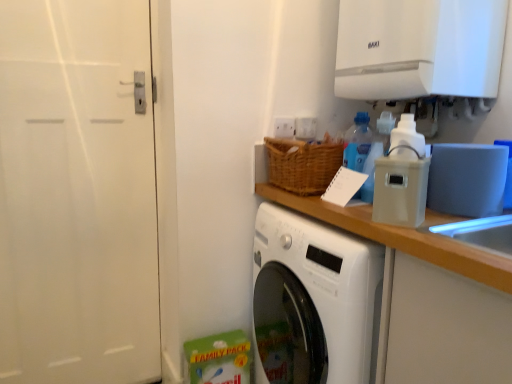
Question: Is translucent plastic soap dispenser at upper right, placed as the 1th bottle when sorted from right to left, looking in the opposite direction of white plastic container at upper right?

Choices:
 (A) yes
 (B) no

Answer: (B)

Question: Is translucent plastic soap dispenser at upper right, the 2th bottle positioned from the left, surrounding white plastic container at upper right?

Choices:
 (A) yes
 (B) no

Answer: (B)

Question: Considering the relative positions of translucent plastic soap dispenser at upper right, placed as the 1th bottle when sorted from right to left, and white plastic container at upper right in the image provided, is translucent plastic soap dispenser at upper right, placed as the 1th bottle when sorted from right to left, to the right of white plastic container at upper right from the viewer's perspective?

Choices:
 (A) yes
 (B) no

Answer: (A)

Question: From a real-world perspective, is translucent plastic soap dispenser at upper right, the 2th bottle positioned from the left, beneath white plastic container at upper right?

Choices:
 (A) yes
 (B) no

Answer: (B)

Question: From the image's perspective, is translucent plastic soap dispenser at upper right, the 2th bottle positioned from the left, below white plastic container at upper right?

Choices:
 (A) yes
 (B) no

Answer: (B)

Question: Considering the relative positions of white plastic container at upper right and blue translucent bottle at upper right, marked as the first bottle in a left-to-right arrangement, in the image provided, is white plastic container at upper right to the right of blue translucent bottle at upper right, marked as the first bottle in a left-to-right arrangement, from the viewer's perspective?

Choices:
 (A) no
 (B) yes

Answer: (B)

Question: Is white plastic container at upper right beside blue translucent bottle at upper right, which appears as the 2th bottle when viewed from the right?

Choices:
 (A) no
 (B) yes

Answer: (A)

Question: Does white plastic container at upper right contain blue translucent bottle at upper right, marked as the first bottle in a left-to-right arrangement?

Choices:
 (A) no
 (B) yes

Answer: (A)

Question: From a real-world perspective, is white plastic container at upper right under blue translucent bottle at upper right, which appears as the 2th bottle when viewed from the right?

Choices:
 (A) yes
 (B) no

Answer: (A)

Question: Is white plastic container at upper right facing away from blue translucent bottle at upper right, which appears as the 2th bottle when viewed from the right?

Choices:
 (A) no
 (B) yes

Answer: (A)

Question: Considering the relative sizes of white plastic container at upper right and blue translucent bottle at upper right, which appears as the 2th bottle when viewed from the right, in the image provided, is white plastic container at upper right bigger than blue translucent bottle at upper right, which appears as the 2th bottle when viewed from the right,?

Choices:
 (A) no
 (B) yes

Answer: (B)

Question: From the image's perspective, is white matte door at left on white glossy exhaust hood at upper right?

Choices:
 (A) no
 (B) yes

Answer: (A)